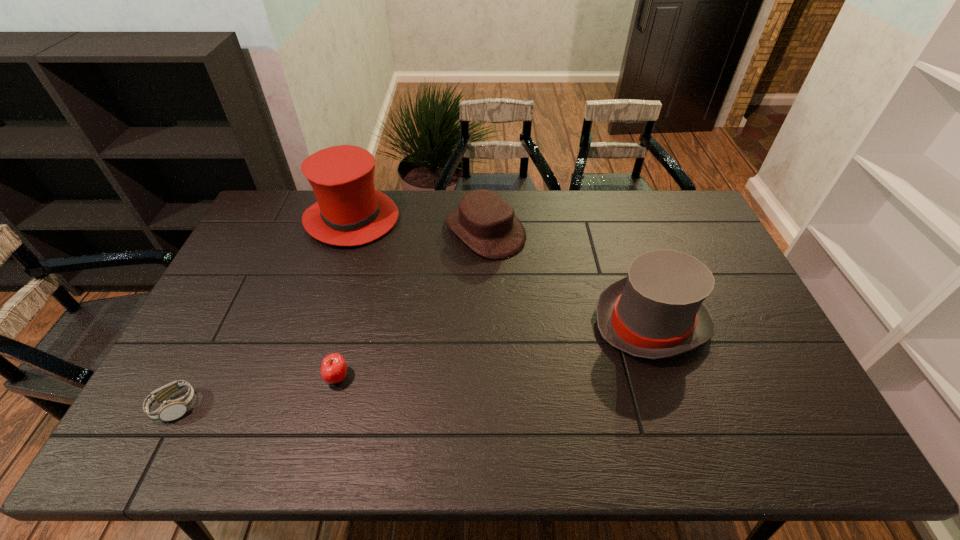
Locate an element on the screen. The width and height of the screenshot is (960, 540). free space at the left edge is located at coordinates (204, 322).

This screenshot has width=960, height=540. Find the location of `free space at the right edge`. free space at the right edge is located at coordinates (721, 334).

In the image, there is a desktop. At what (x,y) coordinates should I click in order to perform the action: click on vacant space at the far left corner. Please return your answer as a coordinate pair (x, y). Looking at the image, I should click on coord(258,215).

The width and height of the screenshot is (960, 540). I want to click on free point between the fourth shortest object and the tallest object, so click(502, 271).

Identify the location of free area in between the shortest hat and the tallest hat. (419, 225).

The height and width of the screenshot is (540, 960). Find the location of `vacant area between the second hat from right to left and the fourth tallest object`. vacant area between the second hat from right to left and the fourth tallest object is located at coordinates (411, 304).

The width and height of the screenshot is (960, 540). Identify the location of blank region between the rightmost object and the leftmost hat. click(502, 271).

Find the location of a particular element. free space between the leftmost object and the rightmost hat is located at coordinates (413, 364).

Identify the location of free space between the shortest object and the apple. (256, 392).

Where is `vacant space that's between the leftmost object and the leftmost hat`? vacant space that's between the leftmost object and the leftmost hat is located at coordinates (263, 313).